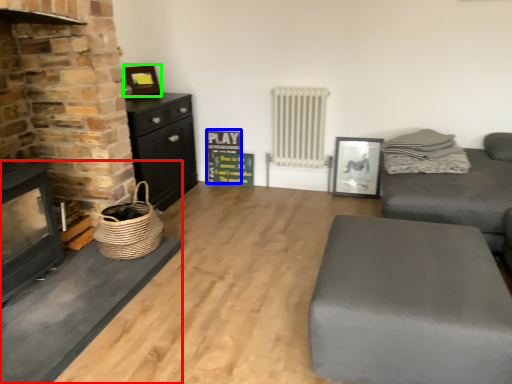
Question: Considering the real-world distances, which object is closest to fireplace (highlighted by a red box)? bulletin board (highlighted by a blue box) or picture frame (highlighted by a green box).

Choices:
 (A) bulletin board
 (B) picture frame

Answer: (B)